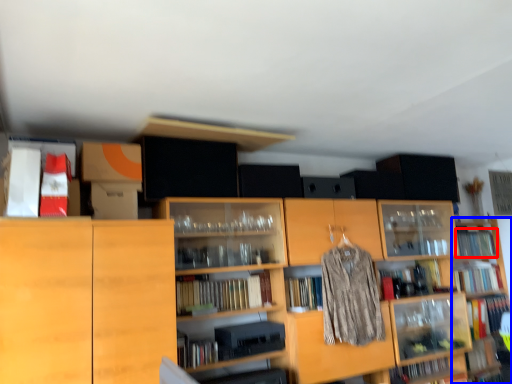
Question: Which of the following is the closest to the observer, book (highlighted by a red box) or shelf (highlighted by a blue box)?

Choices:
 (A) book
 (B) shelf

Answer: (B)